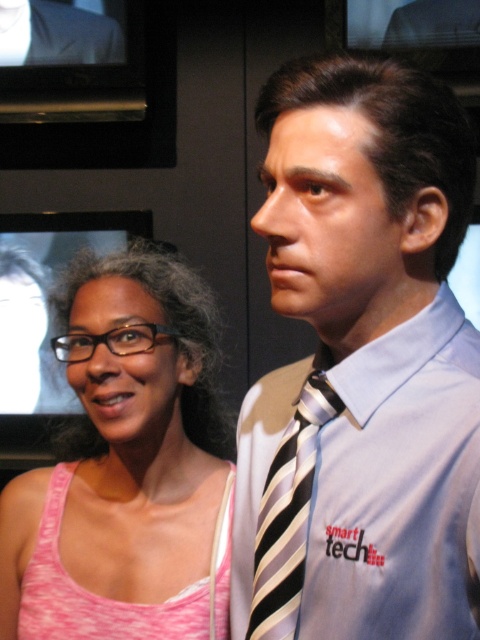
Question: Which point is farther from the camera taking this photo?

Choices:
 (A) pyautogui.click(x=80, y=275)
 (B) pyautogui.click(x=290, y=468)

Answer: (A)

Question: Considering the relative positions of smooth gray shirt at center and pink fabric tank top at left in the image provided, where is smooth gray shirt at center located with respect to pink fabric tank top at left?

Choices:
 (A) right
 (B) left

Answer: (A)

Question: Which object is the farthest from the matte black suit at center?

Choices:
 (A) matte black suit at upper left
 (B) striped silk tie at center
 (C) smooth gray shirt at center

Answer: (B)

Question: Which object is closer to the camera taking this photo?

Choices:
 (A) matte black suit at upper left
 (B) pink fabric tank top at left

Answer: (B)

Question: Can you confirm if smooth gray shirt at center is thinner than pink fabric tank top at left?

Choices:
 (A) no
 (B) yes

Answer: (B)

Question: Is smooth gray shirt at center closer to camera compared to matte black suit at upper left?

Choices:
 (A) yes
 (B) no

Answer: (A)